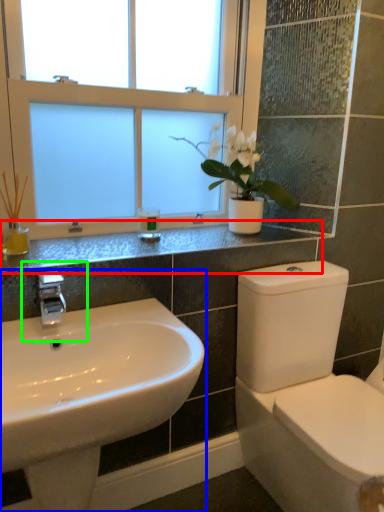
Question: Considering the real-world distances, which object is farthest from counter top (highlighted by a red box)? sink (highlighted by a blue box) or plumbing fixture (highlighted by a green box)?

Choices:
 (A) sink
 (B) plumbing fixture

Answer: (A)